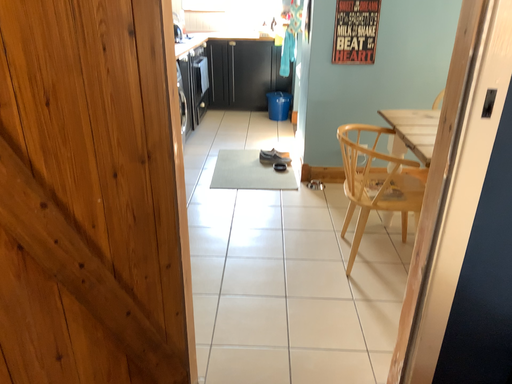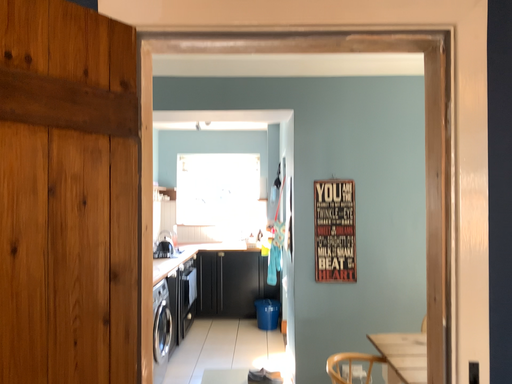
Question: Which way did the camera rotate in the video?

Choices:
 (A) rotated upward
 (B) rotated downward

Answer: (A)